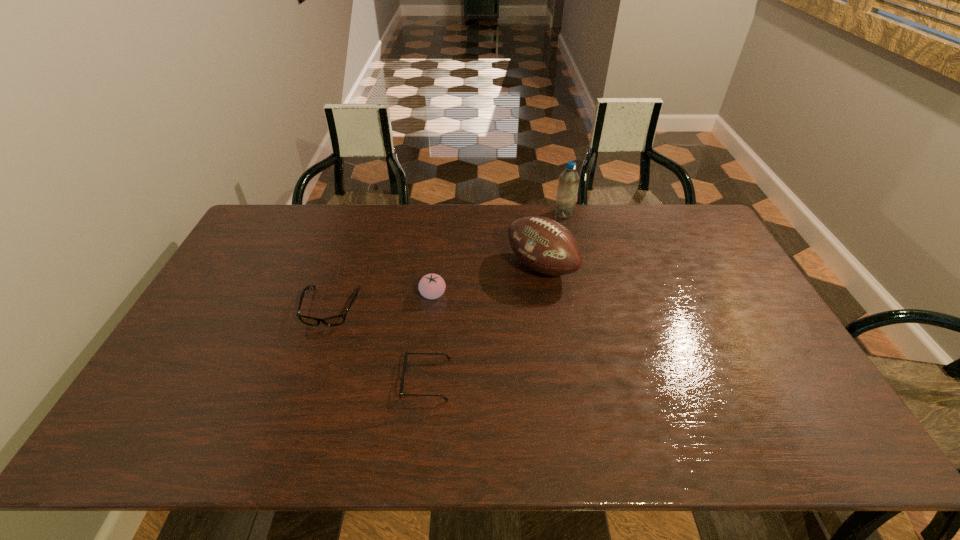
Locate an element on the screen. The width and height of the screenshot is (960, 540). free space located 0.100m on the front-facing side of the taller spectacles is located at coordinates (314, 359).

Locate an element on the screen. The height and width of the screenshot is (540, 960). vacant space situated 0.360m on the front-facing side of the shorter spectacles is located at coordinates (261, 379).

At what (x,y) coordinates should I click in order to perform the action: click on vacant area situated on the front-facing side of the shorter spectacles. Please return your answer as a coordinate pair (x, y). Looking at the image, I should click on (317, 379).

Locate an element on the screen. vacant space located on the front-facing side of the shorter spectacles is located at coordinates (304, 379).

Locate an element on the screen. object that is positioned at the far edge is located at coordinates (567, 191).

Where is `vacant space at the far edge`? Image resolution: width=960 pixels, height=540 pixels. vacant space at the far edge is located at coordinates (480, 206).

In order to click on free location at the near edge in this screenshot , I will do `click(551, 447)`.

What are the coordinates of `vacant region at the left edge of the desktop` in the screenshot? It's located at (259, 296).

The image size is (960, 540). I want to click on free space at the near left corner of the desktop, so click(181, 437).

Where is `free space at the far right corner of the desktop`? free space at the far right corner of the desktop is located at coordinates tap(659, 206).